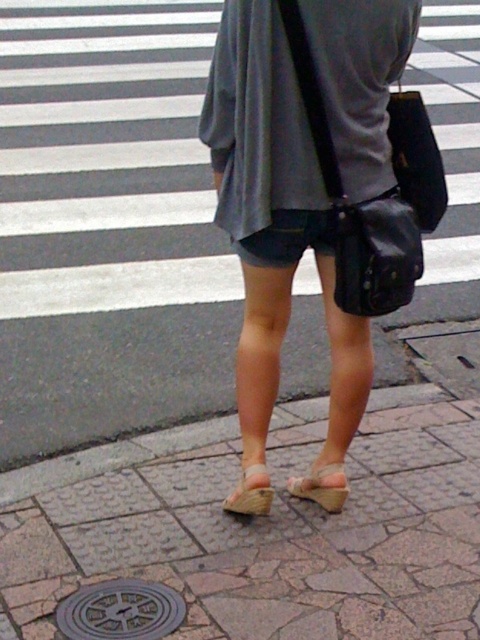
Question: Is the position of brown stone pavement at lower center more distant than that of beige woven sandal at center?

Choices:
 (A) yes
 (B) no

Answer: (B)

Question: Which of the following is the farthest from the observer?

Choices:
 (A) (216, 38)
 (B) (317, 486)
 (C) (380, 442)
 (D) (59, 627)

Answer: (C)

Question: Which of the following is the farthest from the observer?

Choices:
 (A) (75, 621)
 (B) (199, 388)
 (C) (28, 616)

Answer: (B)

Question: Where is brick pavement at center located in relation to brown stone pavement at lower center in the image?

Choices:
 (A) below
 (B) above

Answer: (B)

Question: Which point is farther from the camera taking this photo?

Choices:
 (A) 273,88
 (B) 232,506
 (C) 304,374

Answer: (C)

Question: Can you confirm if brown stone pavement at lower center is positioned above beige woven sandal at center?

Choices:
 (A) no
 (B) yes

Answer: (A)